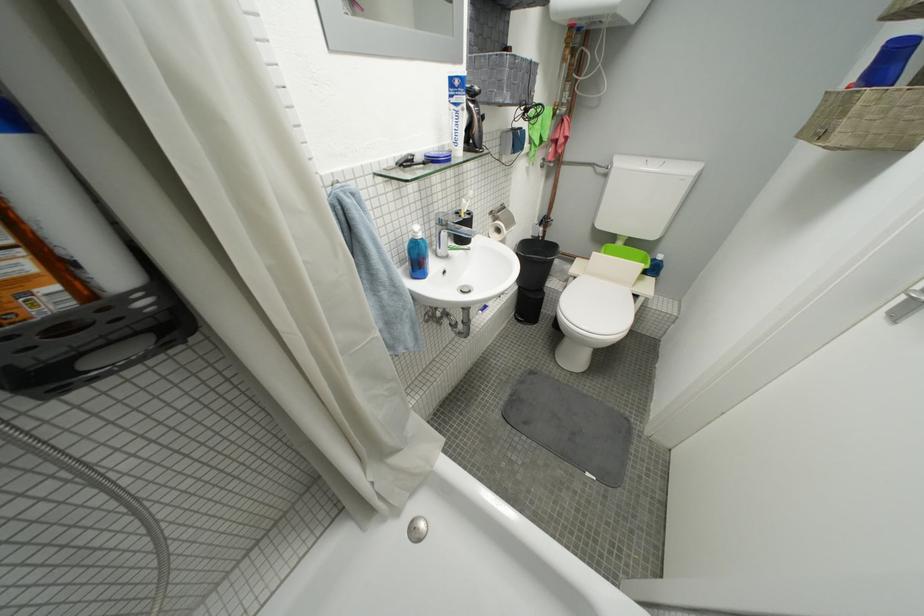
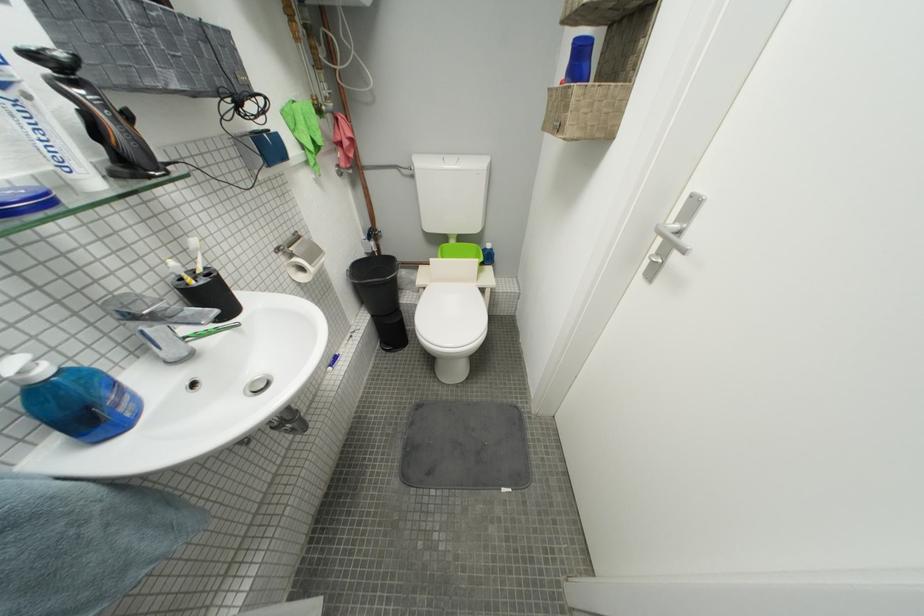
The point at (447, 230) is marked in the first image. Where is the corresponding point in the second image?

(139, 325)